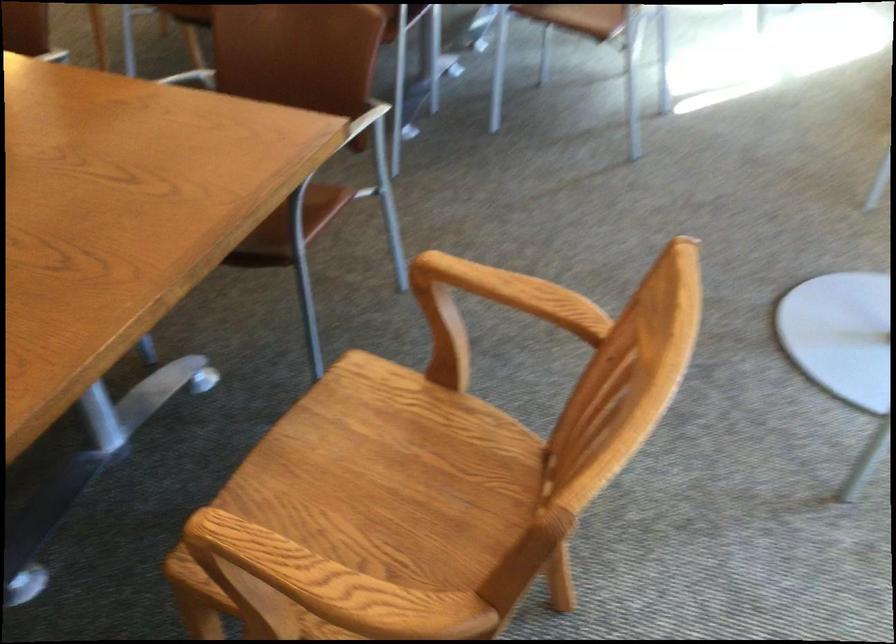
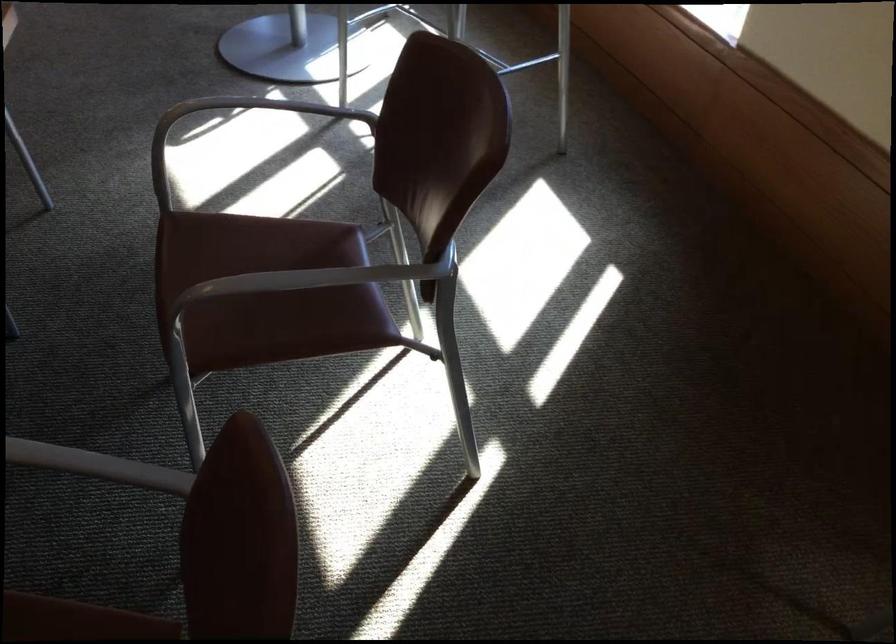
Which direction would the cameraman need to move to produce the second image?

The movement direction of the cameraman is right, forward.